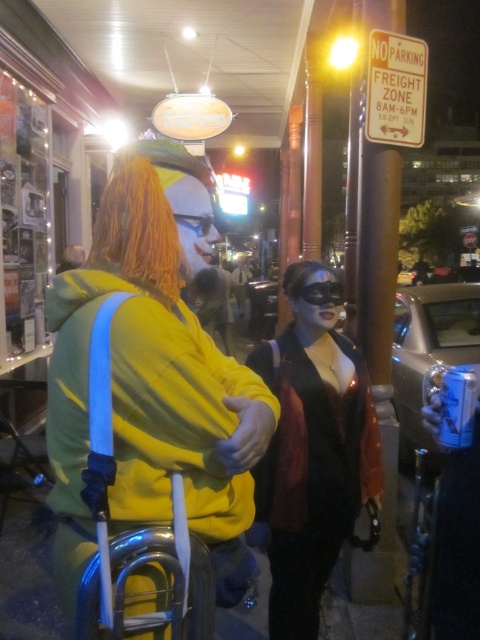
Question: Which of these objects is positioned farthest from the orange synthetic wig at center?

Choices:
 (A) yellow matte hoodie at center
 (B) leather jacket at center

Answer: (B)

Question: Which object is positioned closest to the orange synthetic wig at center?

Choices:
 (A) leather jacket at center
 (B) yellow matte hoodie at center

Answer: (B)

Question: Which point appears farthest from the camera in this image?

Choices:
 (A) (308, 492)
 (B) (250, 380)
 (C) (171, 273)

Answer: (A)

Question: Can you confirm if yellow matte hoodie at center is positioned to the right of leather jacket at center?

Choices:
 (A) yes
 (B) no

Answer: (B)

Question: Can you confirm if yellow matte hoodie at center is thinner than orange synthetic wig at center?

Choices:
 (A) yes
 (B) no

Answer: (B)

Question: Is yellow matte hoodie at center positioned at the back of orange synthetic wig at center?

Choices:
 (A) yes
 (B) no

Answer: (B)